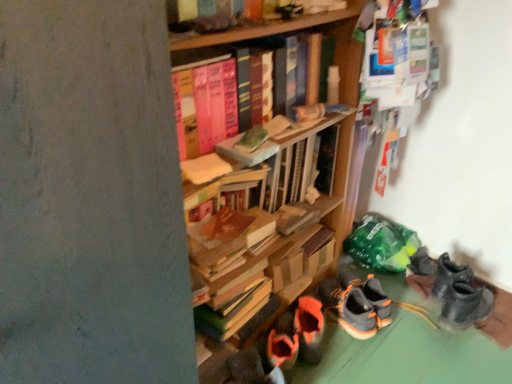
Identify the location of empty space that is to the right of gray suede sneakers at lower center. The width and height of the screenshot is (512, 384). (406, 317).